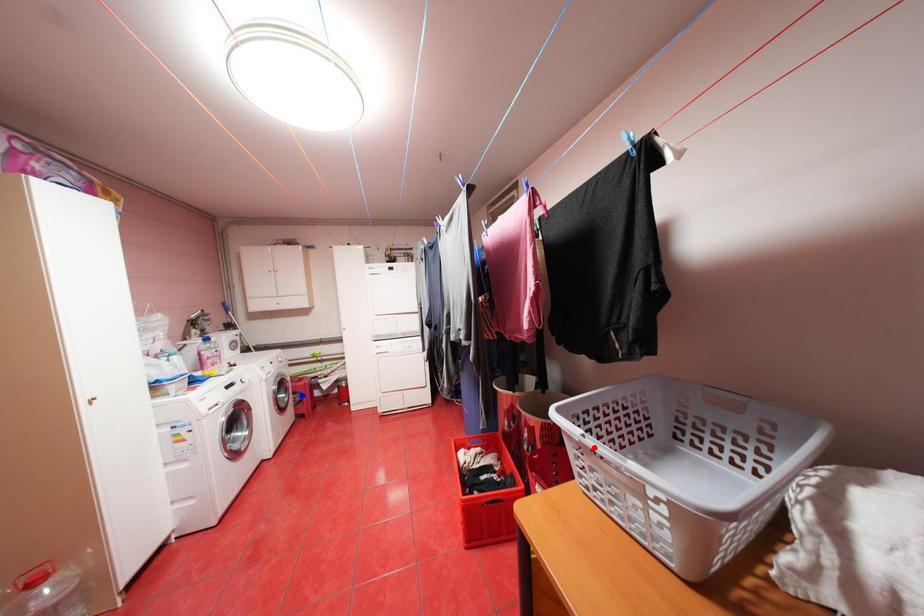
Question: Two points are marked on the image. Which point is closer to the camera?

Choices:
 (A) Blue point is closer.
 (B) Red point is closer.

Answer: (B)